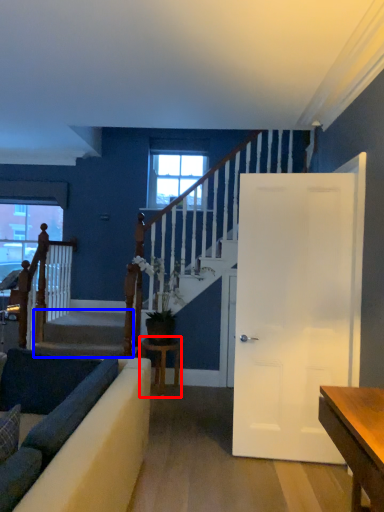
Question: Which point is closer to the camera, table (highlighted by a red box) or stairwell (highlighted by a blue box)?

Choices:
 (A) table
 (B) stairwell

Answer: (A)